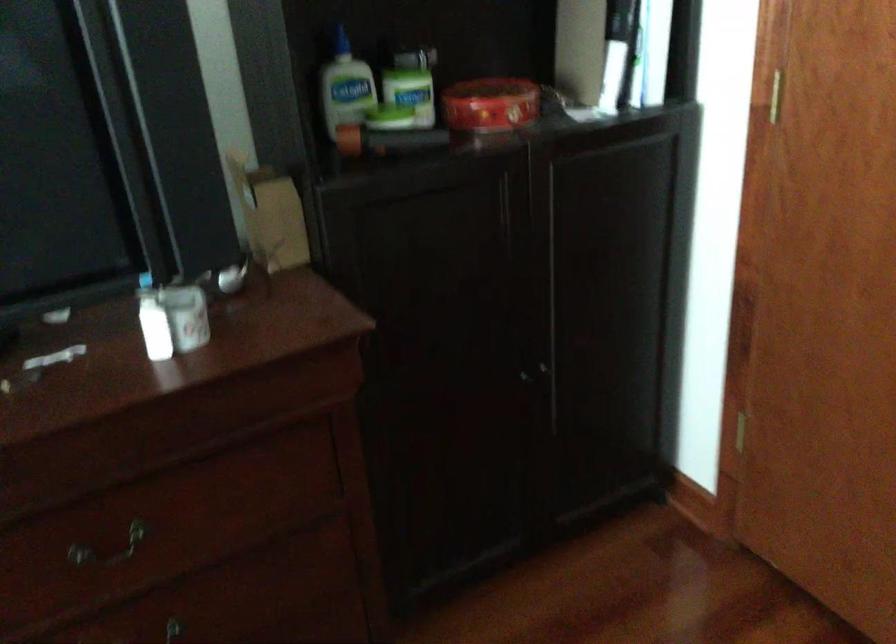
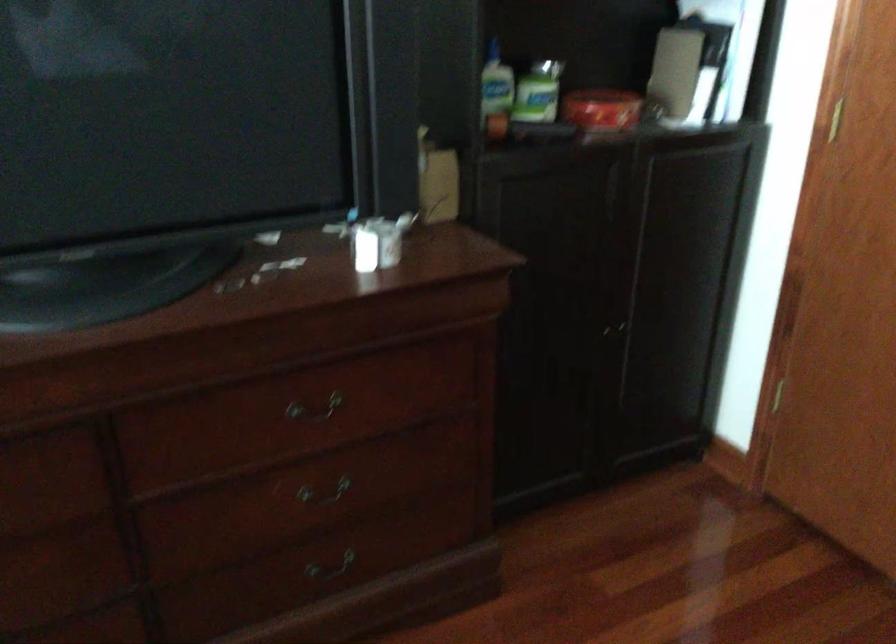
Where in the second image is the point corresponding to (194,313) from the first image?

(378, 242)